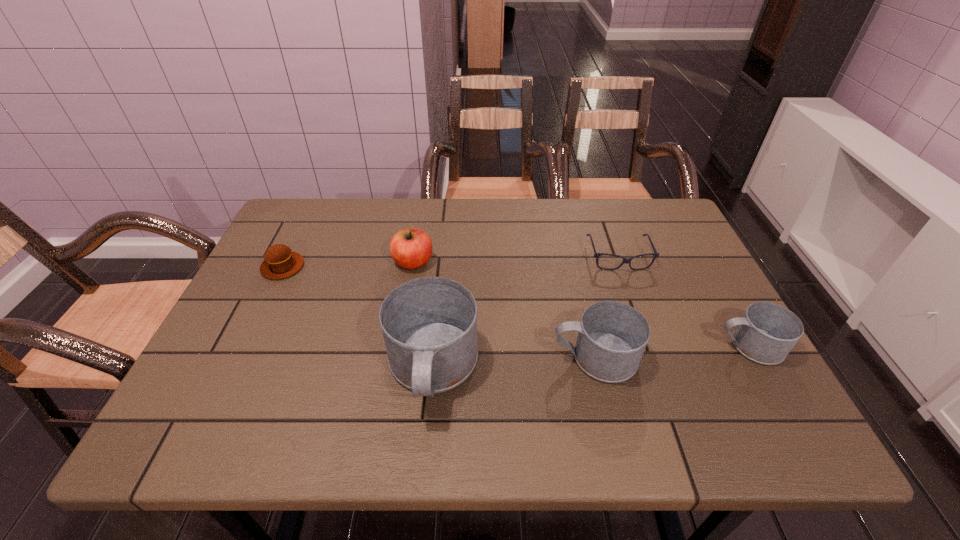
Locate an element on the screen. Image resolution: width=960 pixels, height=540 pixels. unoccupied position between the leftmost object and the rightmost object is located at coordinates (516, 306).

What are the coordinates of `free space between the muffin and the tallest object` in the screenshot? It's located at (357, 318).

Image resolution: width=960 pixels, height=540 pixels. I want to click on free point between the muffin and the apple, so click(348, 265).

Where is `empty location between the apple and the spectacles`? empty location between the apple and the spectacles is located at coordinates point(516,260).

Find the location of a particular element. This screenshot has width=960, height=540. unoccupied position between the shortest object and the shortest mug is located at coordinates (684, 301).

What are the coordinates of `free space between the third shortest object and the leftmost object` in the screenshot? It's located at (516, 306).

Identify the location of vacant space that is in between the third shortest object and the leftmost object. (516, 306).

Where is `the second closest object to the leftmost object`? the second closest object to the leftmost object is located at coordinates (429, 324).

Locate an element on the screen. The width and height of the screenshot is (960, 540). object that stands as the fourth closest to the fourth tallest object is located at coordinates (411, 248).

What are the coordinates of `the second closest mug to the apple` in the screenshot? It's located at (612, 336).